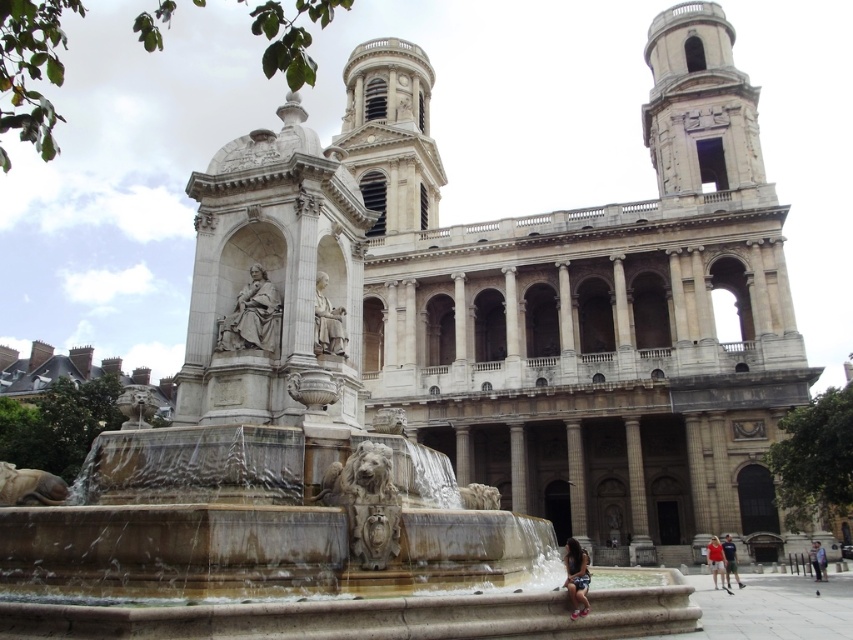
Question: Which of these objects is positioned farthest from the light brown leather jacket at lower right?

Choices:
 (A) matte stone statue at center
 (B) red cotton shirt at lower right
 (C) dark blue jeans at lower right
 (D) dark brown leather jacket at lower center

Answer: (A)

Question: Can you confirm if dark brown leather jacket at lower center is smaller than light brown leather jacket at lower right?

Choices:
 (A) yes
 (B) no

Answer: (B)

Question: Which of the following is the farthest from the observer?

Choices:
 (A) (764, 273)
 (B) (566, 580)
 (C) (814, 561)
 (D) (332, 326)

Answer: (A)

Question: Does marble church at center have a larger size compared to matte stone statue at center?

Choices:
 (A) no
 (B) yes

Answer: (B)

Question: Among these objects, which one is nearest to the camera?

Choices:
 (A) matte stone statue at center
 (B) dark blue jeans at lower right
 (C) red cotton shirt at lower right

Answer: (A)

Question: Is the position of marble church at center more distant than that of red cotton shirt at lower right?

Choices:
 (A) yes
 (B) no

Answer: (B)